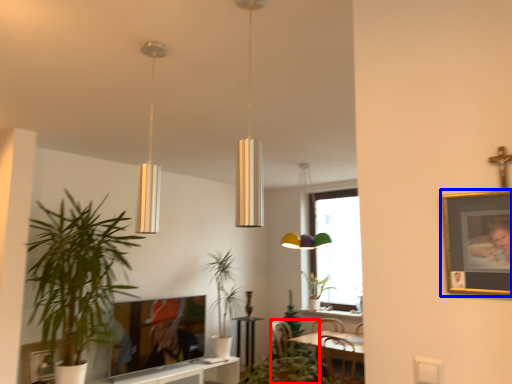
Question: Which of the following is the closest to the observer, swivel chair (highlighted by a red box) or picture frame (highlighted by a blue box)?

Choices:
 (A) swivel chair
 (B) picture frame

Answer: (B)